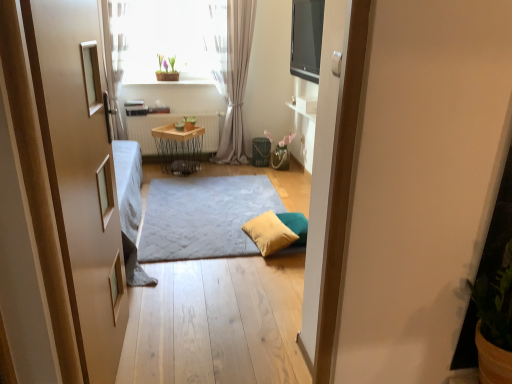
Question: Is wooden radiator at center positioned behind light gray sheer curtain at center?

Choices:
 (A) yes
 (B) no

Answer: (A)

Question: Is light gray sheer curtain at center at the back of wooden radiator at center?

Choices:
 (A) no
 (B) yes

Answer: (A)

Question: Considering the relative positions of wooden radiator at center and light gray sheer curtain at center in the image provided, is wooden radiator at center to the left of light gray sheer curtain at center from the viewer's perspective?

Choices:
 (A) no
 (B) yes

Answer: (B)

Question: Would you say wooden radiator at center contains light gray sheer curtain at center?

Choices:
 (A) yes
 (B) no

Answer: (B)

Question: Can you confirm if wooden radiator at center is smaller than light gray sheer curtain at center?

Choices:
 (A) yes
 (B) no

Answer: (A)

Question: Is light gray sheer curtain at center bigger or smaller than yellow fabric pillow at center?

Choices:
 (A) small
 (B) big

Answer: (B)

Question: Is light gray sheer curtain at center wider or thinner than yellow fabric pillow at center?

Choices:
 (A) thin
 (B) wide

Answer: (A)

Question: In the image, is light gray sheer curtain at center on the left side or the right side of yellow fabric pillow at center?

Choices:
 (A) right
 (B) left

Answer: (B)

Question: From a real-world perspective, is light gray sheer curtain at center positioned above or below yellow fabric pillow at center?

Choices:
 (A) above
 (B) below

Answer: (A)

Question: Considering the positions of soft gray carpet at center and green matte pot at upper center in the image, is soft gray carpet at center taller or shorter than green matte pot at upper center?

Choices:
 (A) tall
 (B) short

Answer: (B)

Question: Based on their sizes in the image, would you say soft gray carpet at center is bigger or smaller than green matte pot at upper center?

Choices:
 (A) big
 (B) small

Answer: (A)

Question: Considering the positions of point (240, 205) and point (175, 59), is point (240, 205) closer or farther from the camera than point (175, 59)?

Choices:
 (A) closer
 (B) farther

Answer: (A)

Question: Is soft gray carpet at center spatially inside green matte pot at upper center, or outside of it?

Choices:
 (A) inside
 (B) outside

Answer: (B)

Question: Relative to wooden/metallic table at center, is light gray sheer curtain at center in front or behind?

Choices:
 (A) behind
 (B) front

Answer: (B)

Question: Looking at the image, does light gray sheer curtain at center seem bigger or smaller compared to wooden/metallic table at center?

Choices:
 (A) small
 (B) big

Answer: (B)